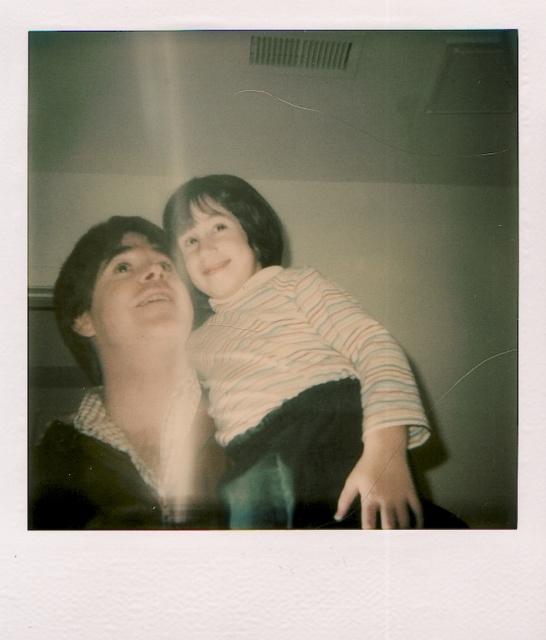
You are a photographer holding a camera 33 inches away from the striped fabric shirt at center. Can you take a clear photo of it without moving closer?

The striped fabric shirt at center and viewer are 33.43 inches apart, so yes, you can take a clear photo of it without moving closer since the distance is sufficient.

You are a photographer analyzing the depth of field in the Polaroid photo. You observe two points labeled as point (387, 432) and point (91, 228). Which point is positioned closer to the camera?

Point (387, 432) is closer to the viewer than point (91, 228), so the photographer should focus on that point for better clarity.

You are a photographer trying to edit this Polaroid image. You want to adjust the focus to the striped fabric shirt at center. What coordinates should you use for the focus point?

The striped fabric shirt at center is located at coordinates point (293, 364), so you should set the focus point to those coordinates to ensure the striped fabric shirt at center is in sharp focus.